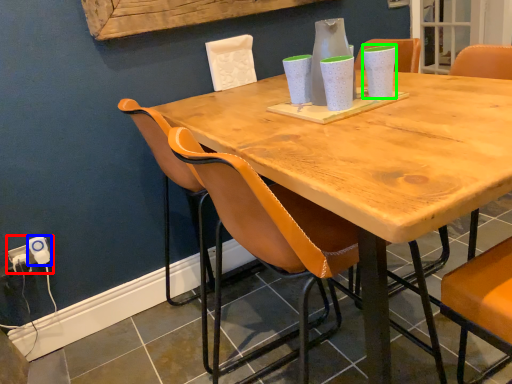
Question: Considering the real-world distances, which object is farthest from electric outlet (highlighted by a red box)? electric outlet (highlighted by a blue box) or vase (highlighted by a green box)?

Choices:
 (A) electric outlet
 (B) vase

Answer: (B)